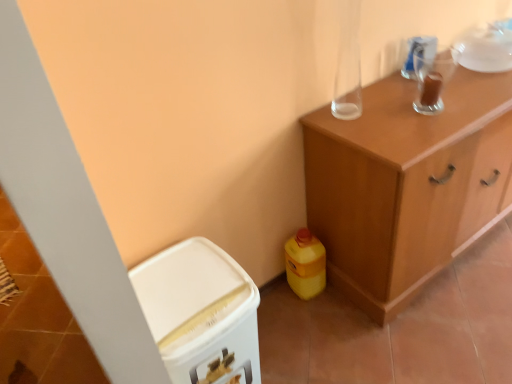
Locate an element on the screen. The image size is (512, 384). vacant area that is in front of transparent glass cup at upper right is located at coordinates (435, 123).